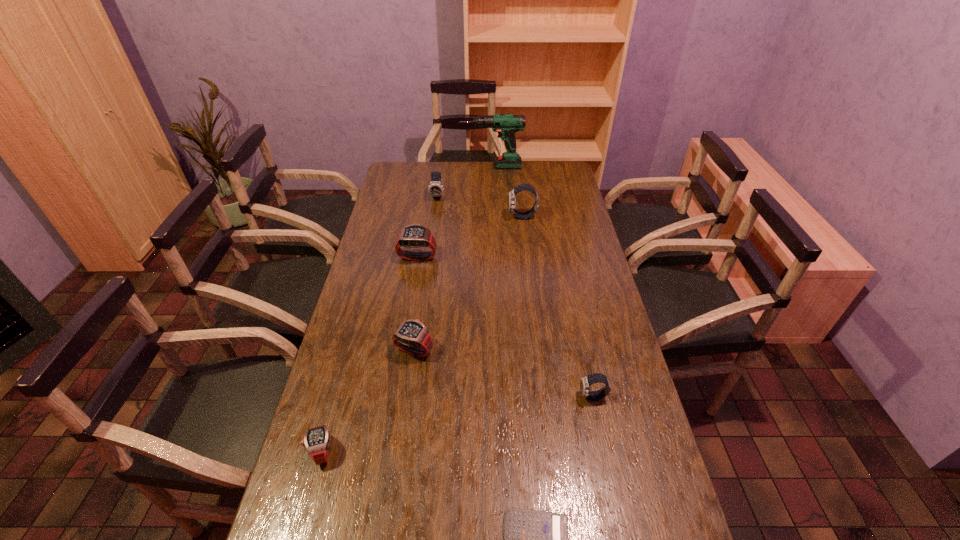
Find the location of a particular element. The height and width of the screenshot is (540, 960). the nearest dark watch is located at coordinates (585, 382).

I want to click on the sixth farthest object, so click(x=585, y=382).

I want to click on the second shortest object, so click(x=316, y=441).

This screenshot has width=960, height=540. Find the location of `the smallest red watch`. the smallest red watch is located at coordinates (316, 441).

The image size is (960, 540). Find the location of `free location located 0.110m on the handle side of the farthest object`. free location located 0.110m on the handle side of the farthest object is located at coordinates (439, 167).

At what (x,y) coordinates should I click in order to perform the action: click on free space located on the handle side of the farthest object. Please return your answer as a coordinate pair (x, y). This screenshot has height=540, width=960. Looking at the image, I should click on (451, 167).

You are a GUI agent. You are given a task and a screenshot of the screen. Output one action in this format:
    pyautogui.click(x=<x>, y=<y>)
    Task: Click on the vacant space located 0.300m on the handle side of the farthest object
    
    Given the screenshot: What is the action you would take?
    pyautogui.click(x=401, y=167)

Locate an element on the screen. The height and width of the screenshot is (540, 960). free region located on the face of the biggest dark watch is located at coordinates (477, 217).

Identify the location of vacant space located on the face of the biggest dark watch. The height and width of the screenshot is (540, 960). (475, 217).

The height and width of the screenshot is (540, 960). In order to click on blank space located 0.090m on the face of the biggest dark watch in this screenshot , I will do `click(487, 217)`.